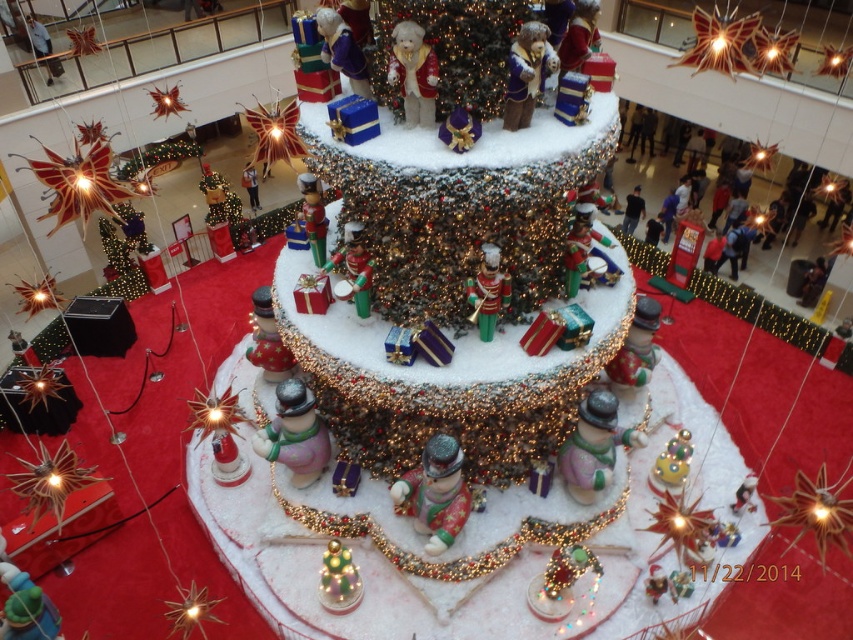
Question: Is the position of frosted glass christmas tree at center more distant than that of shiny silver figurine at center?

Choices:
 (A) yes
 (B) no

Answer: (B)

Question: Is shiny silver figurine at center below fuzzy plush bear at center?

Choices:
 (A) no
 (B) yes

Answer: (B)

Question: Among these objects, which one is farthest from the camera?

Choices:
 (A) shiny green plastic toy soldier at center
 (B) matte gold figurine at upper center
 (C) fuzzy plush bear at center

Answer: (A)

Question: Which point is closer to the camera?

Choices:
 (A) porcelain figurine at center
 (B) fuzzy plush bear at center
 (C) frosted glass christmas tree at center
 (D) matte gold figurine at upper center

Answer: (D)

Question: Can you confirm if shiny silver figurine at center is wider than porcelain figurine at center?

Choices:
 (A) no
 (B) yes

Answer: (B)

Question: Which point is farther from the camera taking this photo?

Choices:
 (A) (496, 269)
 (B) (302, 486)

Answer: (B)